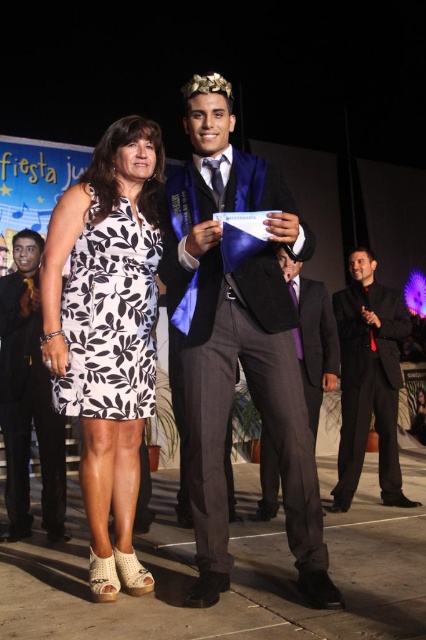
Question: Does white floral dress at center have a larger size compared to matte black suit at center?

Choices:
 (A) yes
 (B) no

Answer: (A)

Question: Does matte black suit at center come in front of black smooth suit at center?

Choices:
 (A) no
 (B) yes

Answer: (B)

Question: Which object is the farthest from the gold metallic crown at upper center?

Choices:
 (A) white floral dress at center
 (B) black printed fabric dress at center
 (C) matte blue graduation gown at center
 (D) matte black suit at center

Answer: (D)

Question: Which of the following is the farthest from the observer?

Choices:
 (A) click(x=393, y=464)
 (B) click(x=319, y=403)

Answer: (A)

Question: Which point appears farthest from the camera in this image?

Choices:
 (A) (49, 360)
 (B) (305, 282)
 (C) (298, 460)
 (D) (132, 419)

Answer: (B)

Question: Can you confirm if matte blue graduation gown at center is positioned to the right of black printed fabric dress at center?

Choices:
 (A) yes
 (B) no

Answer: (A)